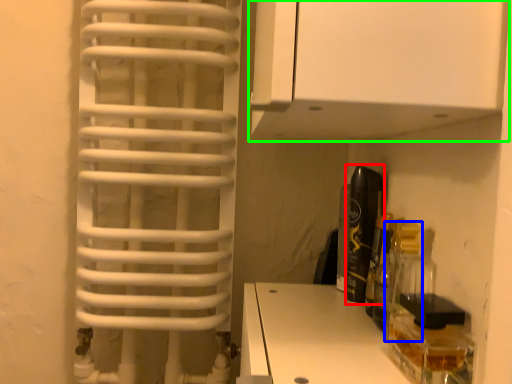
Question: Estimate the real-world distances between objects in this image. Which object is closer to bottle (highlighted by a red box), bottle (highlighted by a blue box) or cabinetry (highlighted by a green box)?

Choices:
 (A) bottle
 (B) cabinetry

Answer: (A)